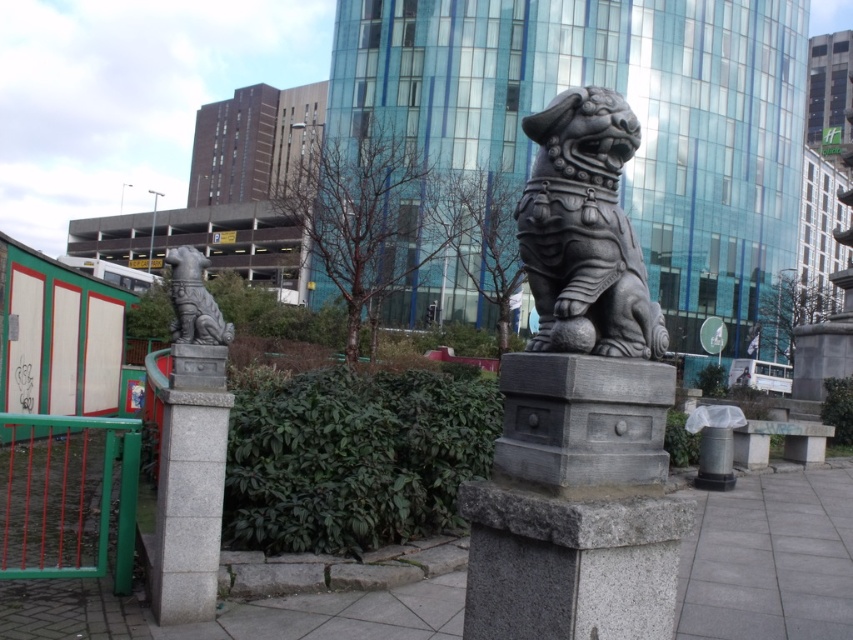
Question: Can you confirm if gray stone lion at center is bigger than green painted metal fence at lower left?

Choices:
 (A) no
 (B) yes

Answer: (A)

Question: Is gray stone lion at center positioned at the back of matte gray stone lion at left?

Choices:
 (A) no
 (B) yes

Answer: (A)

Question: Among these points, which one is farthest from the camera?

Choices:
 (A) (114, 544)
 (B) (201, 280)

Answer: (A)

Question: Is green painted metal fence at lower left further to the viewer compared to matte gray stone lion at left?

Choices:
 (A) yes
 (B) no

Answer: (B)

Question: Estimate the real-world distances between objects in this image. Which object is farther from the green painted metal fence at lower left?

Choices:
 (A) matte gray stone lion at left
 (B) gray stone lion at center

Answer: (B)

Question: Which object is the closest to the gray stone lion at center?

Choices:
 (A) green painted metal fence at lower left
 (B) matte gray stone lion at left

Answer: (B)